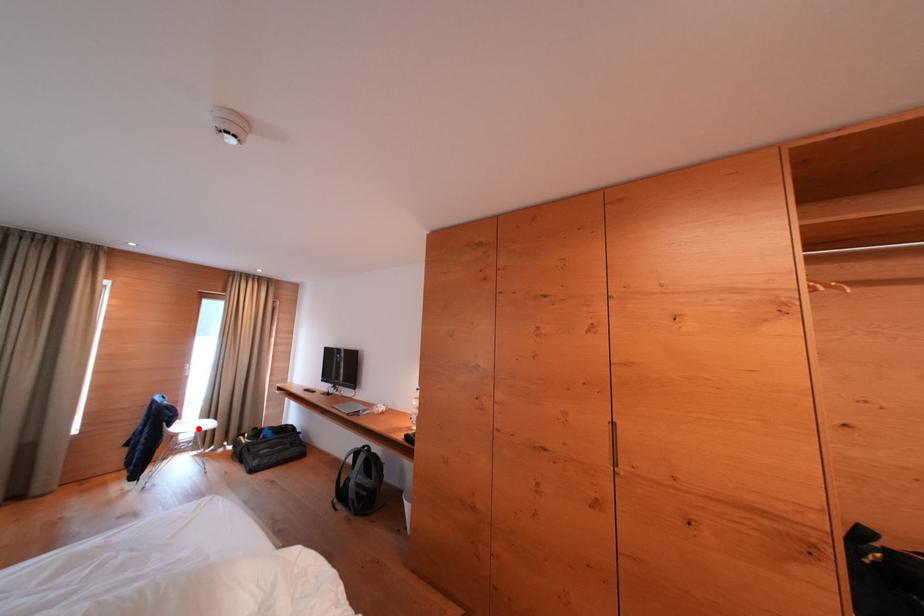
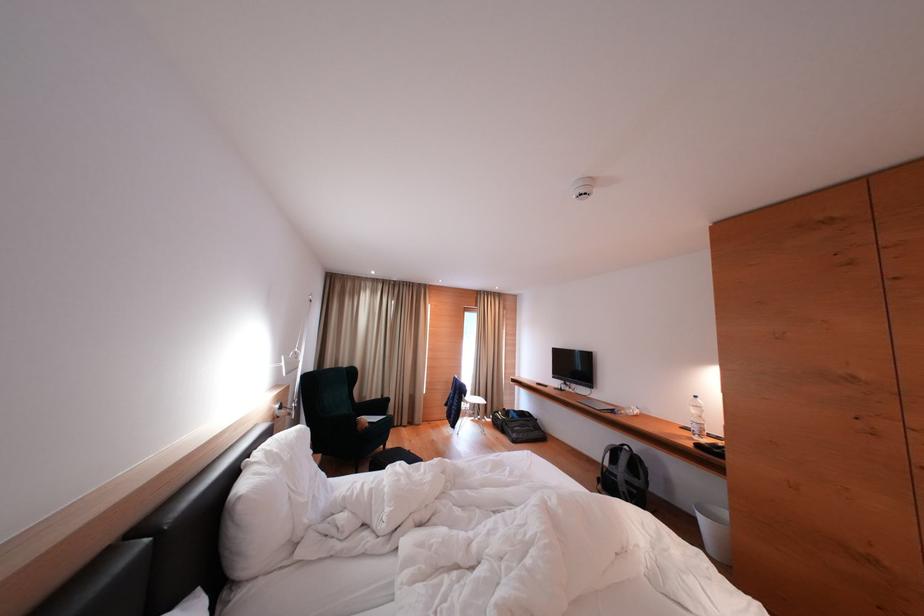
Locate, in the second image, the point that corresponds to the highlighted location in the first image.

(477, 402)